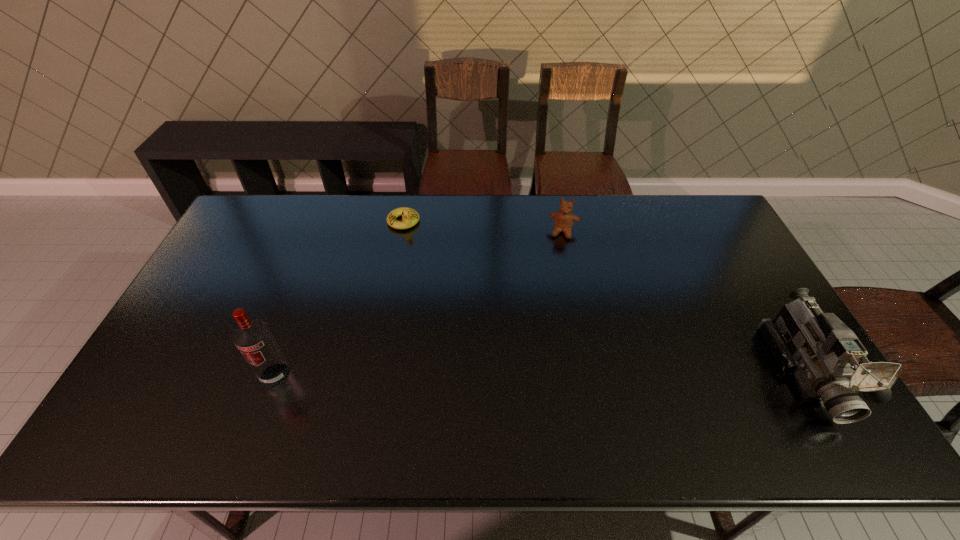
This screenshot has width=960, height=540. What are the coordinates of `vacant area between the shortest object and the rightmost object` in the screenshot? It's located at (604, 296).

At what (x,y) coordinates should I click in order to perform the action: click on blank region between the rightmost object and the second object from left to right. Please return your answer as a coordinate pair (x, y). Looking at the image, I should click on (604, 296).

Find the location of a particular element. unoccupied position between the rightmost object and the duckling is located at coordinates (604, 296).

I want to click on free area in between the third shortest object and the third tallest object, so 684,301.

Identify the location of vacant area that lies between the leftmost object and the teddy bear. (420, 303).

This screenshot has width=960, height=540. I want to click on vacant space that's between the rightmost object and the third object from left to right, so click(x=684, y=301).

At what (x,y) coordinates should I click in order to perform the action: click on vacant space that is in between the second shortest object and the vodka. Please return your answer as a coordinate pair (x, y). The image size is (960, 540). Looking at the image, I should click on (420, 303).

You are a GUI agent. You are given a task and a screenshot of the screen. Output one action in this format:
    pyautogui.click(x=<x>, y=<y>)
    Task: Click on the vacant space in between the camcorder and the third object from left to right
    The width and height of the screenshot is (960, 540).
    Given the screenshot: What is the action you would take?
    pyautogui.click(x=684, y=301)

Select which object appears as the closest to the second object from left to right. Please provide its 2D coordinates. Your answer should be formatted as a tuple, i.e. [(x, y)], where the tuple contains the x and y coordinates of a point satisfying the conditions above.

[(564, 219)]

This screenshot has height=540, width=960. In order to click on object that is the closest to the second object from left to right in this screenshot , I will do `click(564, 219)`.